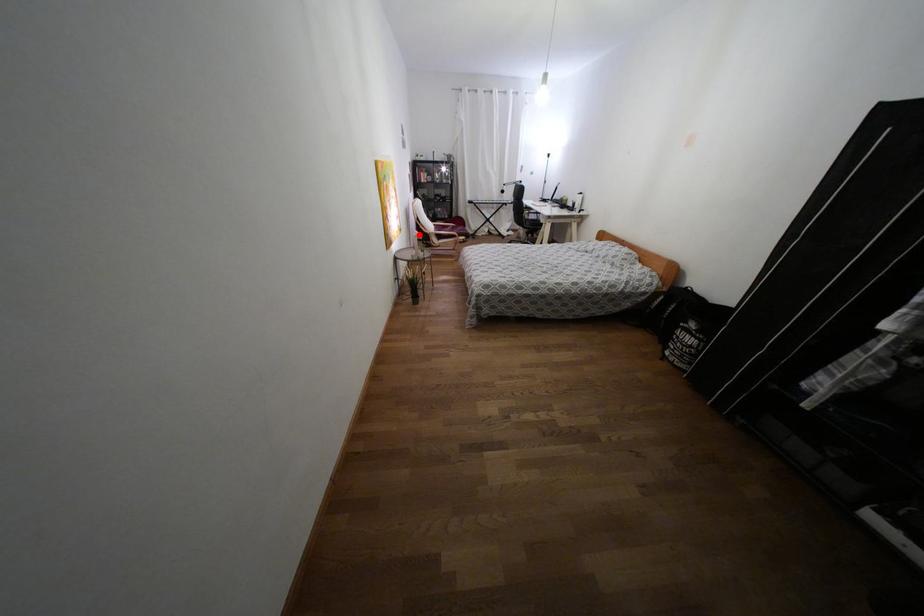
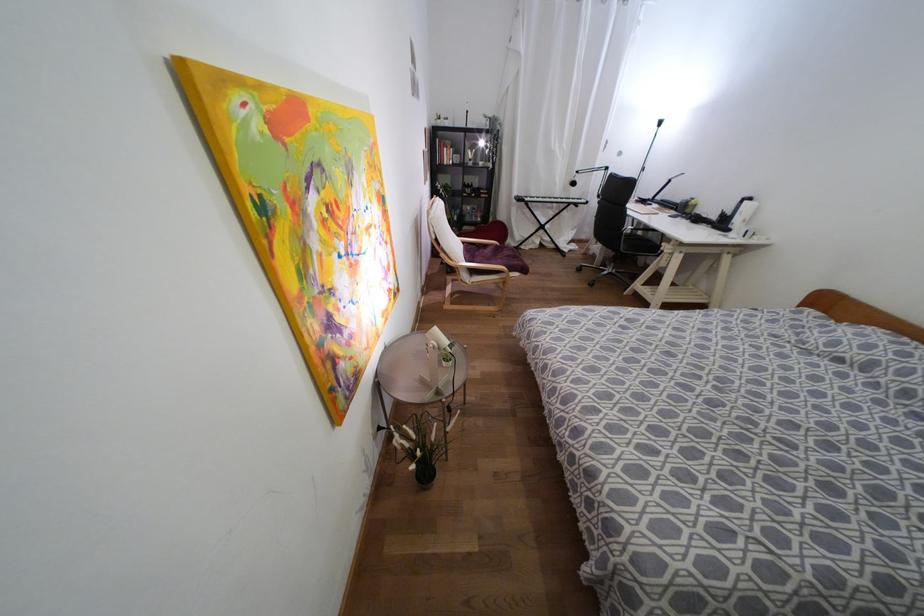
In the second image, find the point that corresponds to the highlighted location in the first image.

(444, 341)